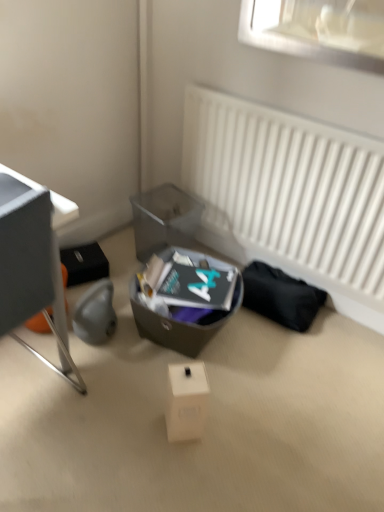
Question: Does white matte radiator at upper right have a larger size compared to matte gray box at center?

Choices:
 (A) no
 (B) yes

Answer: (A)

Question: Is white matte radiator at upper right outside matte gray box at center?

Choices:
 (A) no
 (B) yes

Answer: (B)

Question: Are white matte radiator at upper right and matte gray box at center far apart?

Choices:
 (A) yes
 (B) no

Answer: (B)

Question: Does white matte radiator at upper right have a lesser height compared to matte gray box at center?

Choices:
 (A) no
 (B) yes

Answer: (A)

Question: Can you confirm if white matte radiator at upper right is thinner than matte gray box at center?

Choices:
 (A) no
 (B) yes

Answer: (B)

Question: Would you say white matte radiator at upper right contains matte gray box at center?

Choices:
 (A) no
 (B) yes

Answer: (A)

Question: Is white matte cardboard box at center shorter than white matte radiator at upper right?

Choices:
 (A) yes
 (B) no

Answer: (A)

Question: Is the surface of white matte cardboard box at center in direct contact with white matte radiator at upper right?

Choices:
 (A) yes
 (B) no

Answer: (B)

Question: From a real-world perspective, is white matte cardboard box at center physically above white matte radiator at upper right?

Choices:
 (A) no
 (B) yes

Answer: (A)

Question: From a real-world perspective, is white matte cardboard box at center below white matte radiator at upper right?

Choices:
 (A) no
 (B) yes

Answer: (B)

Question: Is white matte cardboard box at center completely or partially outside of white matte radiator at upper right?

Choices:
 (A) yes
 (B) no

Answer: (A)

Question: Is white matte cardboard box at center aimed at white matte radiator at upper right?

Choices:
 (A) yes
 (B) no

Answer: (B)

Question: From a real-world perspective, is metallic gray desk at left under matte gray box at center?

Choices:
 (A) yes
 (B) no

Answer: (B)